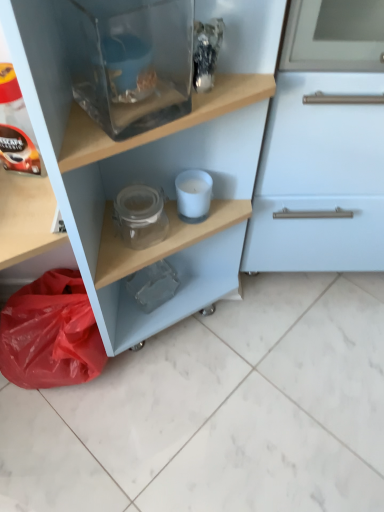
Where is `vacant area that is in front of transparent glass jar at upper center`? Image resolution: width=384 pixels, height=512 pixels. vacant area that is in front of transparent glass jar at upper center is located at coordinates click(115, 445).